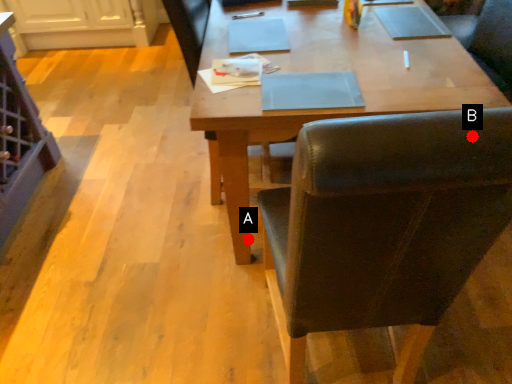
Question: Two points are circled on the image, labeled by A and B beside each circle. Among these points, which one is nearest to the camera?

Choices:
 (A) A is closer
 (B) B is closer

Answer: (B)